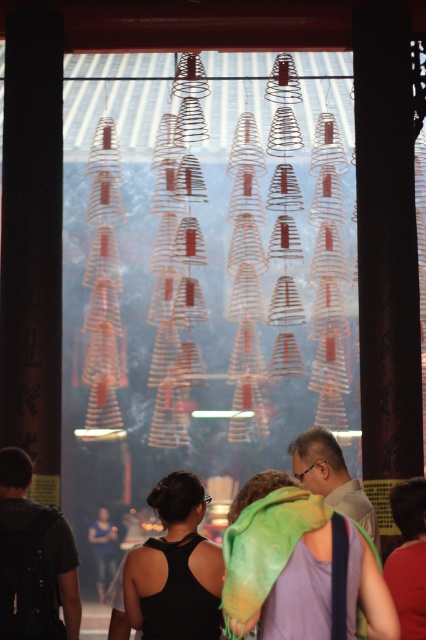
Question: From the image, what is the correct spatial relationship of black matte tank top at lower center in relation to black backpack at lower left?

Choices:
 (A) below
 (B) above

Answer: (B)

Question: Is black matte tank top at lower center thinner than red fabric at lower right?

Choices:
 (A) no
 (B) yes

Answer: (A)

Question: Which of these objects is positioned closest to the red fabric at lower right?

Choices:
 (A) black matte tank top at lower center
 (B) black backpack at lower left
 (C) matte black shirt at center

Answer: (A)

Question: Among these points, which one is nearest to the camera?

Choices:
 (A) (235, 529)
 (B) (100, 538)
 (C) (8, 502)

Answer: (A)

Question: Can you confirm if multicolored scarf at center is bigger than black backpack at lower left?

Choices:
 (A) yes
 (B) no

Answer: (A)

Question: Among these objects, which one is nearest to the camera?

Choices:
 (A) black matte tank top at lower center
 (B) multicolored scarf at center

Answer: (B)